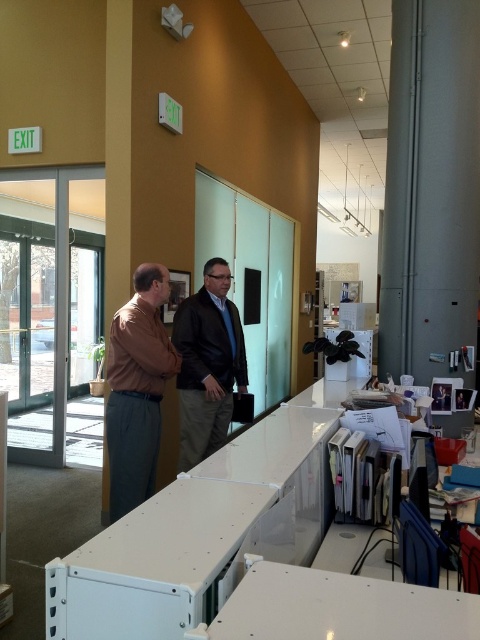
Question: Is brown smooth shirt at center bigger than dark brown leather jacket at center?

Choices:
 (A) no
 (B) yes

Answer: (A)

Question: Among these points, which one is nearest to the camera?

Choices:
 (A) (115, 508)
 (B) (216, 269)

Answer: (A)

Question: Where is brown smooth shirt at center located in relation to dark brown leather jacket at center in the image?

Choices:
 (A) left
 (B) right

Answer: (A)

Question: Which point is closer to the camera?

Choices:
 (A) brown smooth shirt at center
 (B) dark brown leather jacket at center

Answer: (A)

Question: Can you confirm if brown smooth shirt at center is positioned to the left of dark brown leather jacket at center?

Choices:
 (A) yes
 (B) no

Answer: (A)

Question: Which object is closer to the camera taking this photo?

Choices:
 (A) dark brown leather jacket at center
 (B) brown smooth shirt at center

Answer: (B)